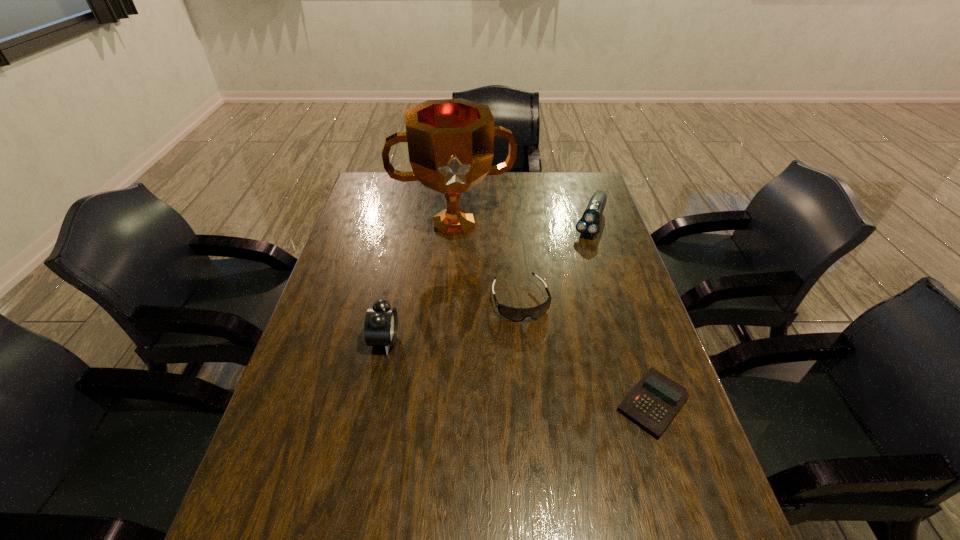
Find the location of a particular element. This screenshot has height=540, width=960. vacant space on the desktop that is between the fourth farthest object and the shortest object and is positioned on the head of the third shortest object is located at coordinates point(527,374).

This screenshot has width=960, height=540. Identify the location of vacant space on the desktop that is between the alarm clock and the calculator and is positioned on the side of the tallest object with the star emblem. (479, 362).

Where is `vacant space on the desktop that is between the second tallest object and the nearest object and is positioned on the front and sides of the second shortest object`? This screenshot has width=960, height=540. vacant space on the desktop that is between the second tallest object and the nearest object and is positioned on the front and sides of the second shortest object is located at coordinates (548, 379).